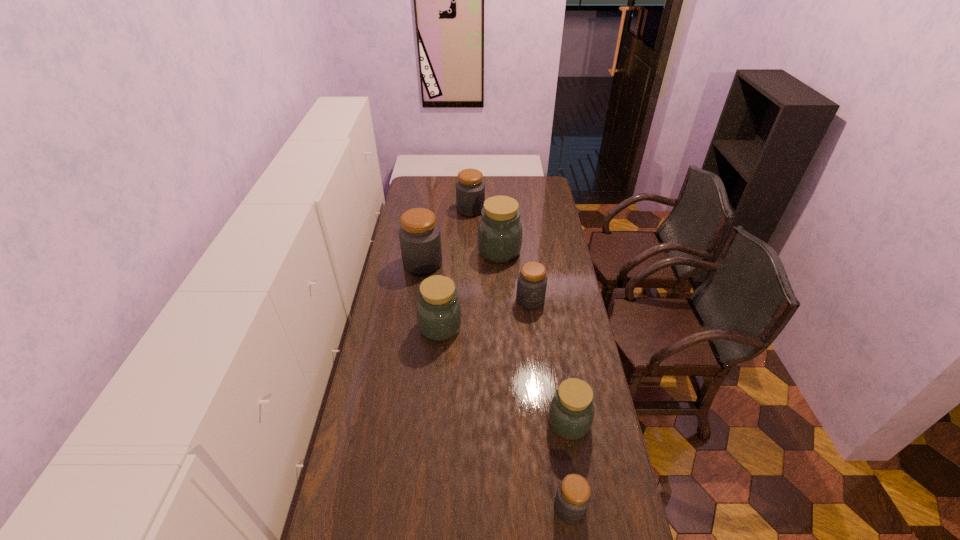
I want to click on the farthest green jar, so click(499, 238).

Identify the location of the second green jar from right to left. (499, 238).

Find the location of a particular element. the leftmost gray jar is located at coordinates (420, 241).

Find the location of a particular element. The width and height of the screenshot is (960, 540). the biggest gray jar is located at coordinates (420, 241).

Identify the location of the farthest gray jar. (470, 189).

The height and width of the screenshot is (540, 960). What are the coordinates of `the third smallest gray jar` in the screenshot? It's located at (470, 189).

I want to click on the third nearest object, so click(x=439, y=315).

The image size is (960, 540). In order to click on the third nearest jar in this screenshot , I will do `click(439, 315)`.

Where is `the fourth farthest object`? the fourth farthest object is located at coordinates (532, 281).

The image size is (960, 540). I want to click on the third farthest gray jar, so click(532, 281).